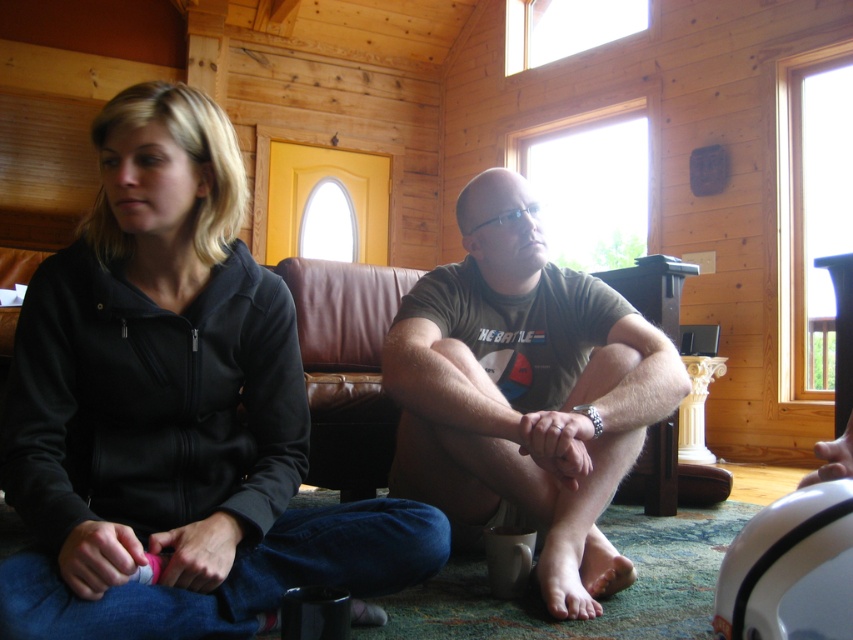
Is black fleece jacket at center closer to camera compared to matte gray t-shirt at center?

Yes, it is in front of matte gray t-shirt at center.

Is black fleece jacket at center wider than matte gray t-shirt at center?

Yes.

This screenshot has width=853, height=640. What do you see at coordinates (172, 410) in the screenshot?
I see `black fleece jacket at center` at bounding box center [172, 410].

Locate an element on the screen. The image size is (853, 640). black fleece jacket at center is located at coordinates (172, 410).